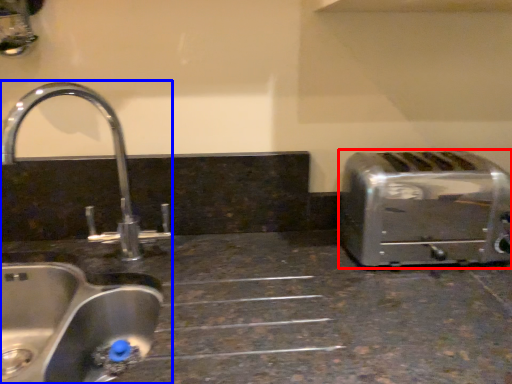
Question: Which of the following is the closest to the observer, toaster (highlighted by a red box) or sink (highlighted by a blue box)?

Choices:
 (A) toaster
 (B) sink

Answer: (B)